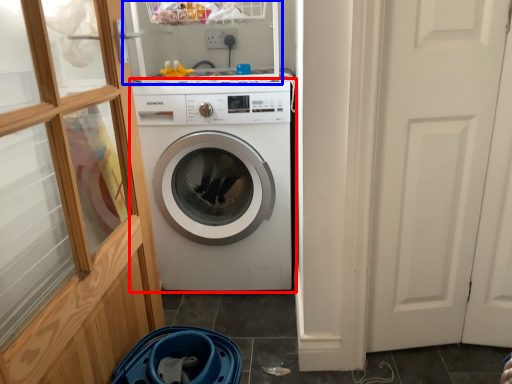
Question: Which object appears farthest to the camera in this image, washing machine (highlighted by a red box) or shelf (highlighted by a blue box)?

Choices:
 (A) washing machine
 (B) shelf

Answer: (A)